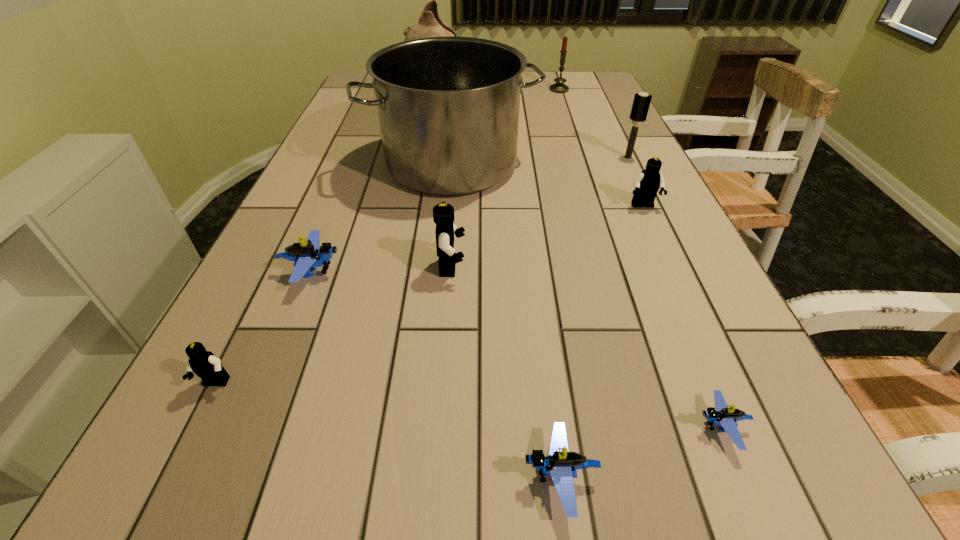
Where is `pottery`? This screenshot has width=960, height=540. pottery is located at coordinates (430, 24).

Find the location of `saucepan`. saucepan is located at coordinates [448, 107].

Image resolution: width=960 pixels, height=540 pixels. Find the location of `hairbrush`. hairbrush is located at coordinates (641, 103).

The height and width of the screenshot is (540, 960). Identify the location of the seventh object from left to right. (559, 87).

Locate an element on the screen. red candle is located at coordinates (559, 87).

You are a GUI agent. You are given a task and a screenshot of the screen. Output one action in this format:
    pyautogui.click(x=<x>, y=<y>)
    Task: Click on the tallest Lego
    This screenshot has width=960, height=540.
    Given the screenshot: What is the action you would take?
    pyautogui.click(x=443, y=213)

Locate an element on the screen. the biggest black Lego is located at coordinates (443, 213).

Locate an element on the screen. The height and width of the screenshot is (540, 960). the farthest black Lego is located at coordinates (647, 183).

Where is `the farthest Lego`? Image resolution: width=960 pixels, height=540 pixels. the farthest Lego is located at coordinates (647, 183).

Identify the location of the leftmost blue Lego. This screenshot has height=540, width=960. (308, 255).